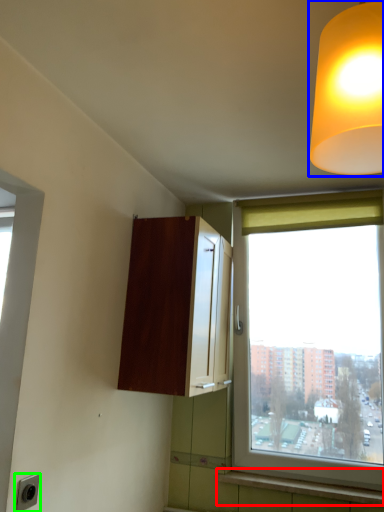
Question: Which is farther away from window sill (highlighted by a red box)? lamp (highlighted by a blue box) or electric outlet (highlighted by a green box)?

Choices:
 (A) lamp
 (B) electric outlet

Answer: (A)